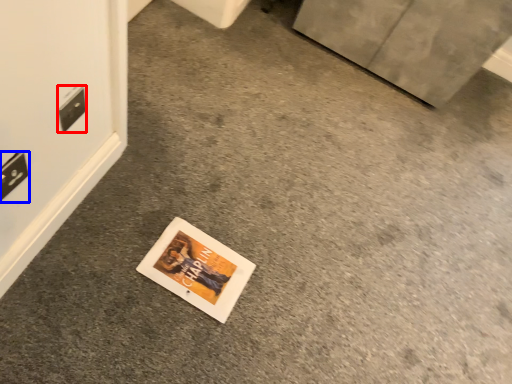
Question: Among these objects, which one is nearest to the camera, electric outlet (highlighted by a red box) or electric outlet (highlighted by a blue box)?

Choices:
 (A) electric outlet
 (B) electric outlet

Answer: (B)